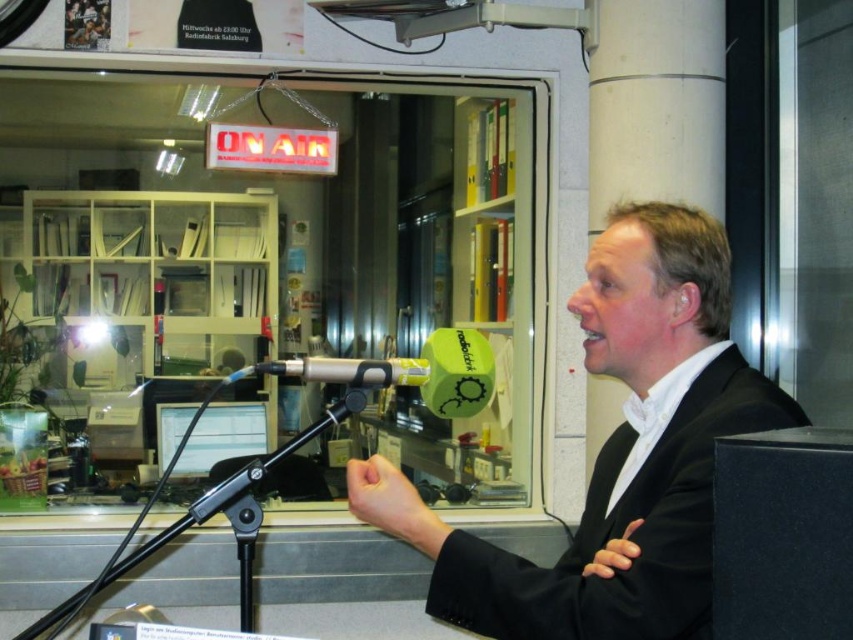
You are a sound technician in a radio studio. You need to place a new microphone stand that won not block the view of the host wearing a matte black suit at center. The current microphone is at point (x=616, y=452). Where should you place the new stand?

The point (x=616, y=452) is on the matte black suit at center, so placing the new stand away from that area would prevent blocking the host.

Consider the image. You are a sound technician in the studio. You notice the matte black suit at center and the metallic silver microphone at center. Which object is closer to the bottom edge of the frame?

The matte black suit at center is positioned under the metallic silver microphone at center, so it is closer to the bottom edge of the frame.